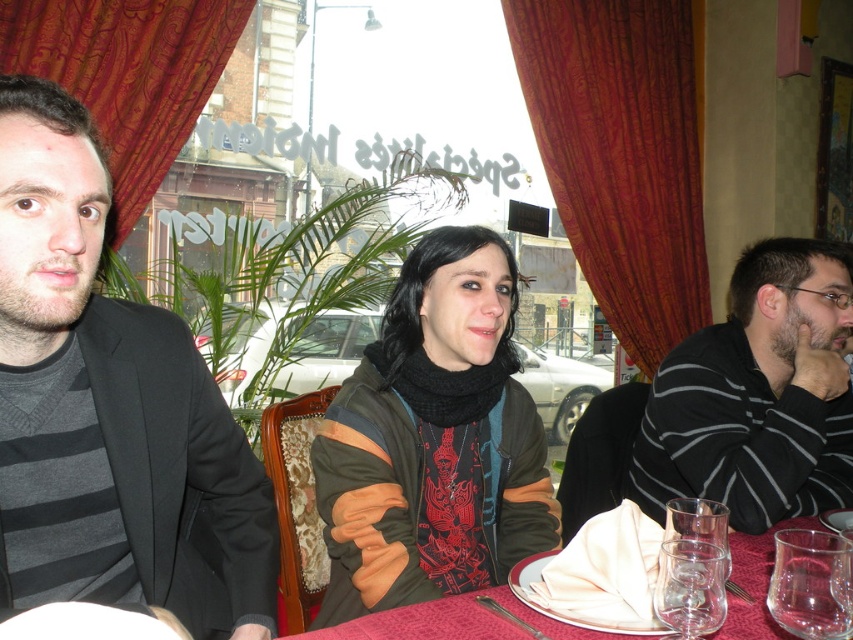
You are a server in this restaurant and need to quickly move from the matte black jacket at left to the striped cotton shirt at right to take an order. Can you walk directly between them without needing to detour around any obstacles?

The distance between the matte black jacket at left and the striped cotton shirt at right is 1.06 meters. Since there are no obstacles mentioned in the scene description, you can walk directly between them without needing to detour.

You are a customer who wants to hang your clothes on the back of the chair. The chair can only support items up to the height of the striped cotton shirt at right. Can you safely hang the matte black jacket at left on the chair?

The matte black jacket at left is much taller than the striped cotton shirt at right, so it exceeds the chair height limit. It is not safe to hang the matte black jacket at left on the chair.